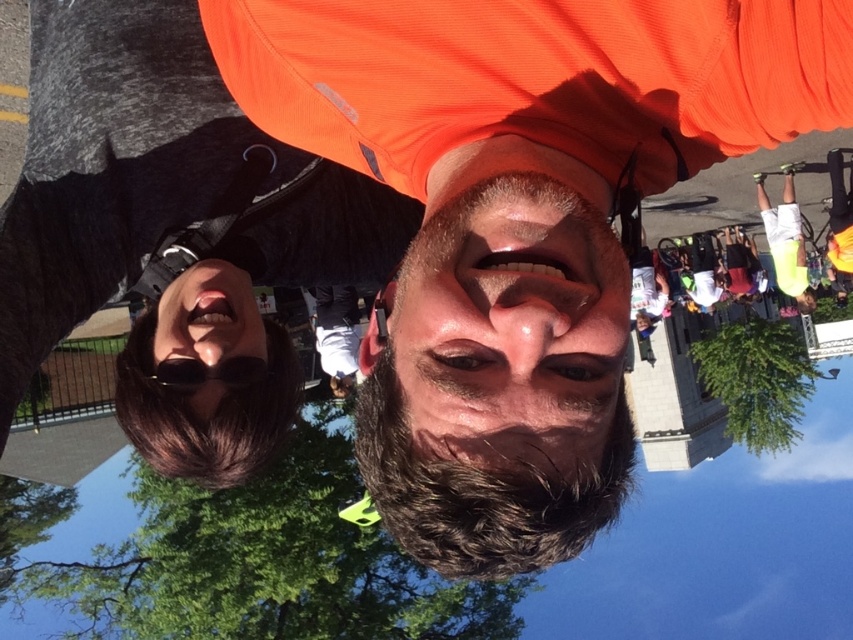
Measure the distance from brown matte beard at center to black matte sunglasses at lower left.

brown matte beard at center is 87.52 centimeters from black matte sunglasses at lower left.

Find the location of `brown matte beard at center`. brown matte beard at center is located at coordinates (512, 328).

Is point (614, 257) more distant than point (189, 388)?

No.

What are the coordinates of `brown matte beard at center` in the screenshot? It's located at (512, 328).

Does point (183, 301) come farther from viewer compared to point (236, 296)?

No, (183, 301) is in front of (236, 296).

Is brown hair at lower left wider than sunglasses at lower left?

Correct, the width of brown hair at lower left exceeds that of sunglasses at lower left.

Is point (160, 337) closer to camera compared to point (198, 268)?

That is True.

Locate an element on the screen. The width and height of the screenshot is (853, 640). brown hair at lower left is located at coordinates (206, 380).

From the picture: Is brown matte beard at center positioned before sunglasses at lower left?

Yes.

What do you see at coordinates (512, 328) in the screenshot? I see `brown matte beard at center` at bounding box center [512, 328].

Describe the element at coordinates (512, 328) in the screenshot. Image resolution: width=853 pixels, height=640 pixels. I see `brown matte beard at center` at that location.

At what (x,y) coordinates should I click in order to perform the action: click on brown matte beard at center. Please return your answer as a coordinate pair (x, y). Image resolution: width=853 pixels, height=640 pixels. Looking at the image, I should click on (512, 328).